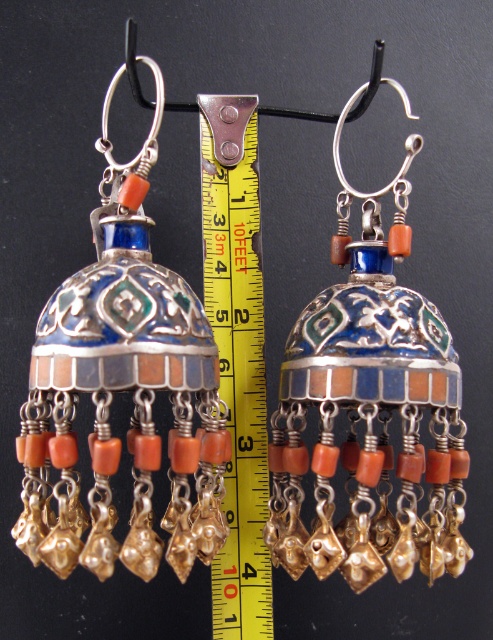
Question: Which of the following is the farthest from the observer?

Choices:
 (A) matte silver earrings at left
 (B) yellow/yellowish plastic ruler at center

Answer: (B)

Question: Can you confirm if matte silver earrings at left is positioned below yellow/yellowish plastic ruler at center?

Choices:
 (A) yes
 (B) no

Answer: (B)

Question: Considering the relative positions of matte silver earrings at left and yellow/yellowish plastic ruler at center in the image provided, where is matte silver earrings at left located with respect to yellow/yellowish plastic ruler at center?

Choices:
 (A) above
 (B) below

Answer: (A)

Question: Is enamel and silver earrings at center further to camera compared to yellow/yellowish plastic ruler at center?

Choices:
 (A) yes
 (B) no

Answer: (B)

Question: Which point is closer to the camera?

Choices:
 (A) (153, 397)
 (B) (236, 250)

Answer: (A)

Question: Which is farther from the enamel and silver earrings at center?

Choices:
 (A) matte silver earrings at left
 (B) yellow/yellowish plastic ruler at center

Answer: (A)